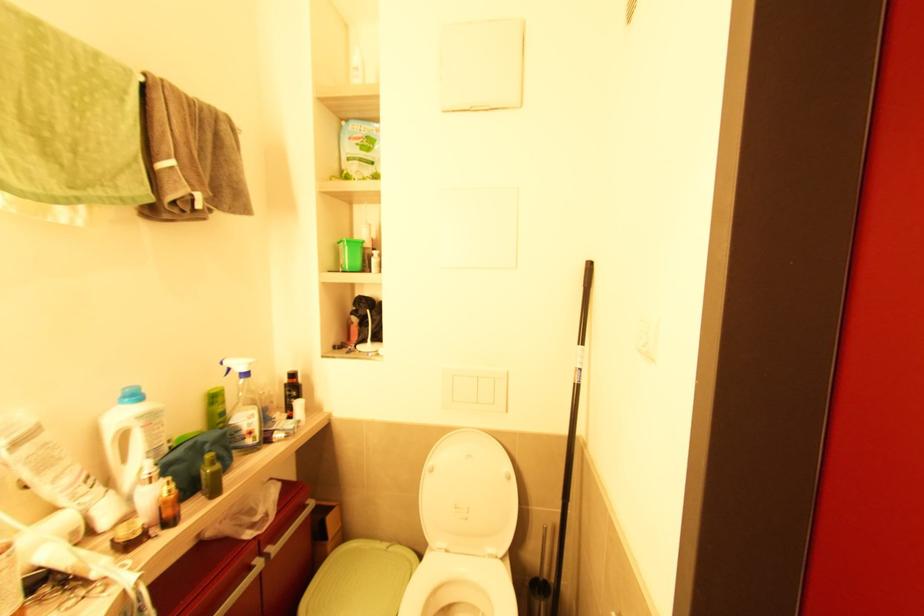
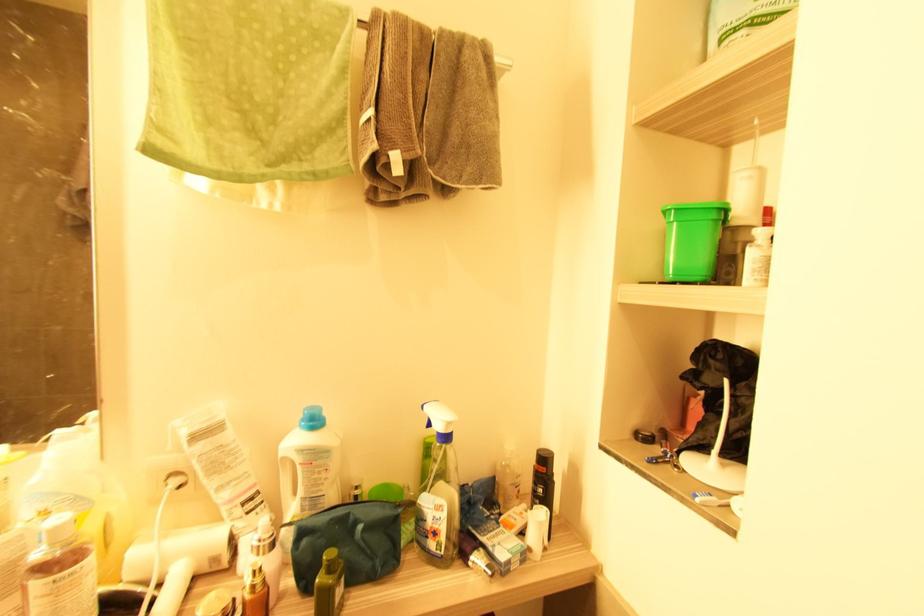
Where in the second image is the point corresponding to the point at 76,533 from the first image?

(216, 561)